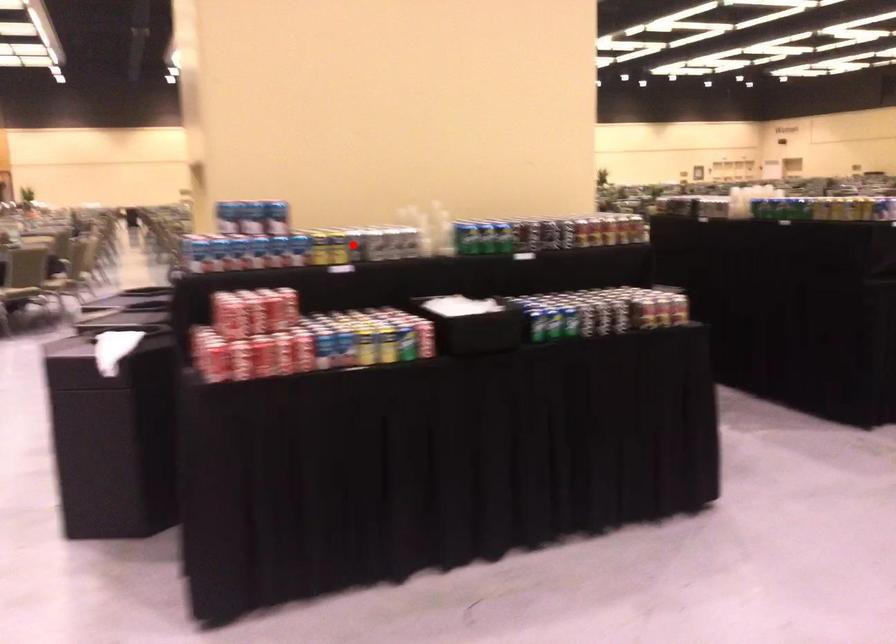
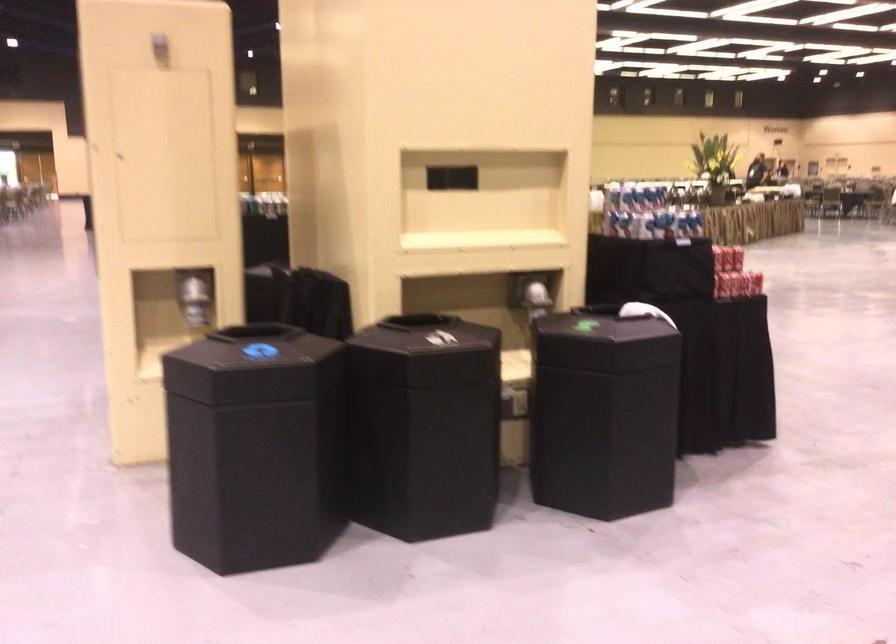
Question: I am providing you with two images of the same scene from different viewpoints. A red point is marked on the first image. At the location where the point appears in image 1, is it still visible in image 2?

Choices:
 (A) Yes
 (B) No

Answer: (B)